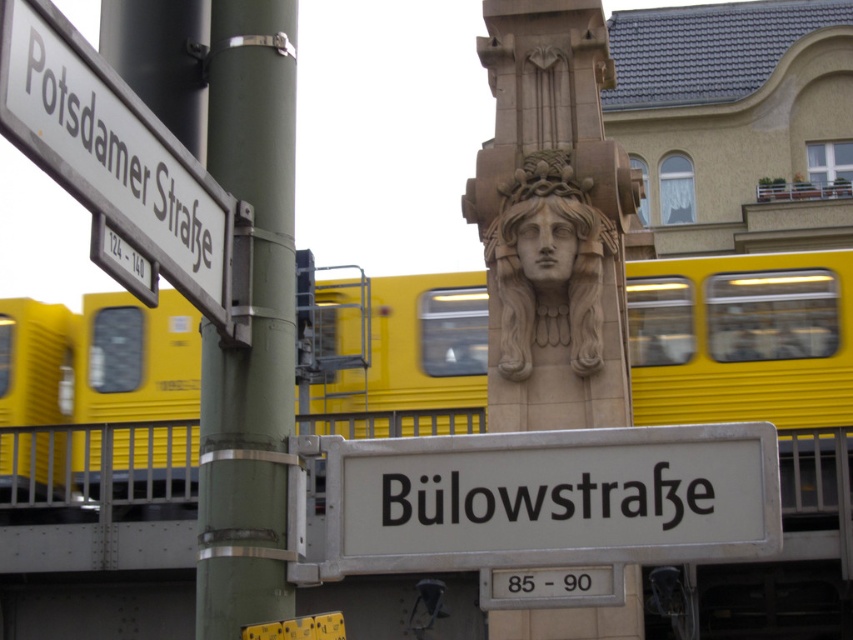
Question: Considering the real-world distances, which object is farthest from the green metallic pole at left?

Choices:
 (A) white metallic sign at center
 (B) carved stone head at center
 (C) white plastic street sign at upper left
 (D) yellow matte train at center

Answer: (D)

Question: Is yellow matte train at center wider than carved stone head at center?

Choices:
 (A) no
 (B) yes

Answer: (B)

Question: Does green metallic pole at left have a greater width compared to white plastic street sign at upper left?

Choices:
 (A) yes
 (B) no

Answer: (B)

Question: Does green metallic pole at left have a lesser width compared to white plastic street sign at upper left?

Choices:
 (A) no
 (B) yes

Answer: (B)

Question: Considering the real-world distances, which object is closest to the carved stone head at center?

Choices:
 (A) yellow matte train at center
 (B) white plastic street sign at upper left

Answer: (A)

Question: Which of the following is the farthest from the observer?

Choices:
 (A) (140, 152)
 (B) (200, 358)
 (C) (579, 456)
 (D) (4, 368)

Answer: (D)